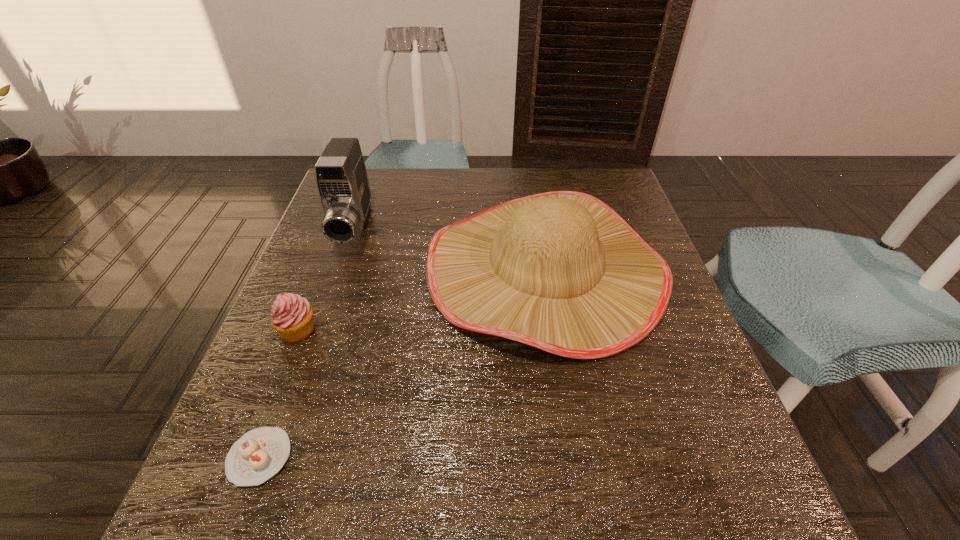
Locate an element on the screen. camcorder is located at coordinates (341, 178).

Locate an element on the screen. The width and height of the screenshot is (960, 540). sunhat is located at coordinates (561, 271).

In order to click on the taller cupcake in this screenshot , I will do `click(292, 316)`.

Where is `the third tallest object`? Image resolution: width=960 pixels, height=540 pixels. the third tallest object is located at coordinates (292, 316).

This screenshot has width=960, height=540. What are the coordinates of `the nearer cupcake` in the screenshot? It's located at (259, 454).

Identify the location of the shortest object. (259, 454).

Find the location of a particular element. free space located 0.220m at the front of the camcorder, highlighting the lens is located at coordinates (318, 331).

Identify the location of free point located on the left of the sunhat. (337, 269).

You are a GUI agent. You are given a task and a screenshot of the screen. Output one action in this format:
    pyautogui.click(x=<x>, y=<y>)
    Task: Click on the vacant space situated on the back of the third tallest object
    
    Given the screenshot: What is the action you would take?
    pyautogui.click(x=331, y=246)

The width and height of the screenshot is (960, 540). What are the coordinates of `vacant space located on the right of the nearer cupcake` in the screenshot? It's located at (542, 457).